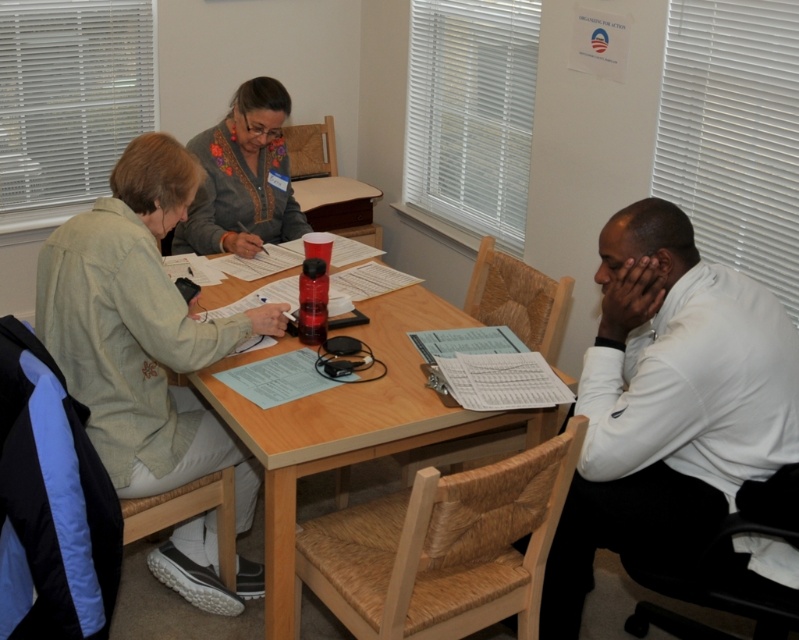
What is located at the coordinates point (x=668, y=403)?

The white shirt at right is located at point (x=668, y=403).

In the scene shown: You are organizing a small gathering and need to place a knitted gray sweater at center on the wooden table at center. Will the sweater fit entirely on the table?

The wooden table at center might be wider than knitted gray sweater at center, so there is a possibility that the sweater will fit entirely on the table, but the exact dimensions are uncertain.